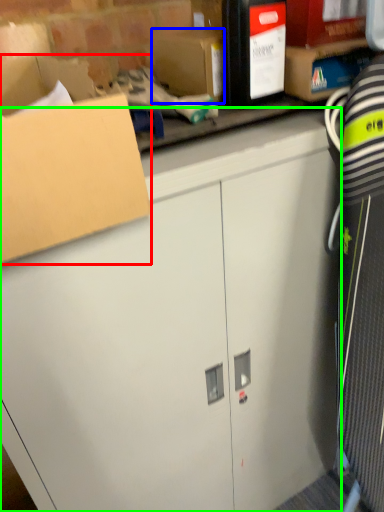
Question: Which object is positioned closest to box (highlighted by a red box)? Select from storage box (highlighted by a blue box) and cabinetry (highlighted by a green box).

Choices:
 (A) storage box
 (B) cabinetry

Answer: (A)